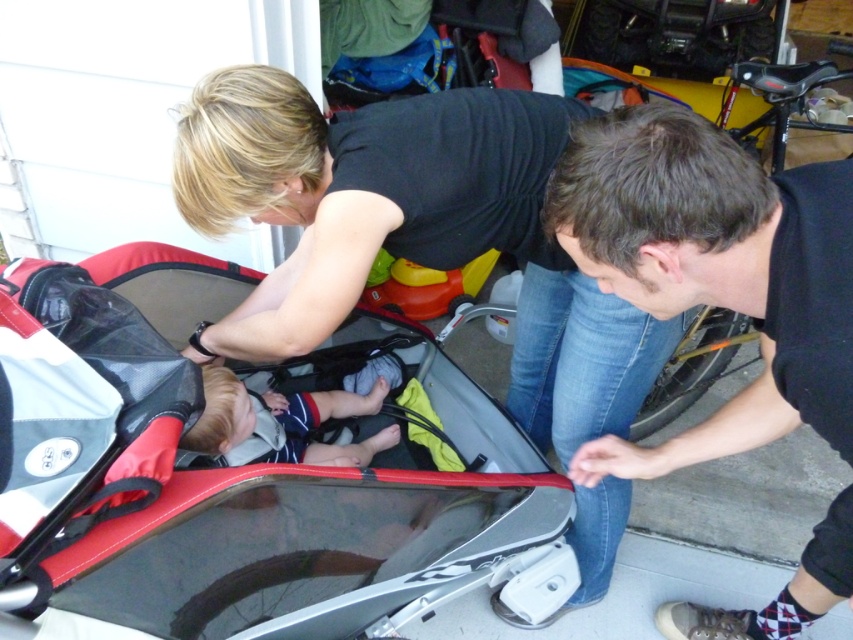
Question: Estimate the real-world distances between objects in this image. Which object is farther from the dark brown hair at lower right?

Choices:
 (A) black matte stroller at center
 (B) soft beige fabric baby at center
 (C) red plastic baby carriage at center

Answer: (B)

Question: Estimate the real-world distances between objects in this image. Which object is farther from the dark brown hair at lower right?

Choices:
 (A) black matte stroller at center
 (B) red plastic baby carriage at center

Answer: (B)

Question: Can you confirm if red plastic baby carriage at center is positioned to the left of black matte stroller at center?

Choices:
 (A) no
 (B) yes

Answer: (B)

Question: Observing the image, what is the correct spatial positioning of black matte stroller at center in reference to dark brown hair at lower right?

Choices:
 (A) below
 (B) above

Answer: (A)

Question: Can you confirm if dark brown hair at lower right is positioned to the left of soft beige fabric baby at center?

Choices:
 (A) no
 (B) yes

Answer: (A)

Question: Among these points, which one is farthest from the camera?

Choices:
 (A) (491, 540)
 (B) (715, 612)

Answer: (B)